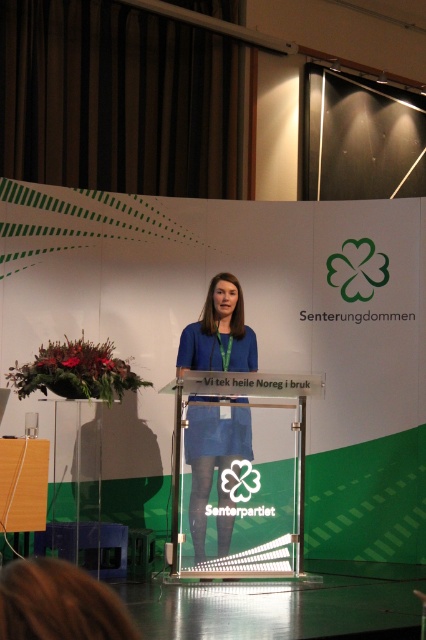
Is transparent glass podium at center wider than blue fabric dress at center?

Yes, transparent glass podium at center is wider than blue fabric dress at center.

Does transparent glass podium at center have a lesser width compared to blue fabric dress at center?

Incorrect, transparent glass podium at center's width is not less than blue fabric dress at center's.

Between point (264, 401) and point (189, 369), which one is positioned behind?

The point (189, 369) is behind.

I want to click on transparent glass podium at center, so click(238, 474).